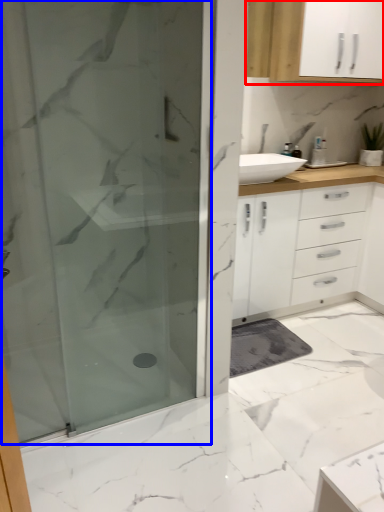
Question: Which of the following is the closest to the observer, cabinetry (highlighted by a red box) or shower door (highlighted by a blue box)?

Choices:
 (A) cabinetry
 (B) shower door

Answer: (B)